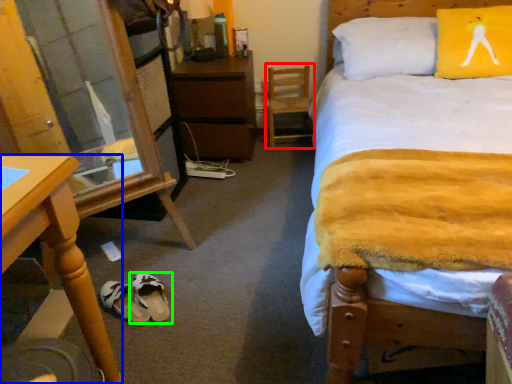
Question: Considering the real-world distances, which object is farthest from swivel chair (highlighted by a red box)? desk (highlighted by a blue box) or footwear (highlighted by a green box)?

Choices:
 (A) desk
 (B) footwear

Answer: (A)